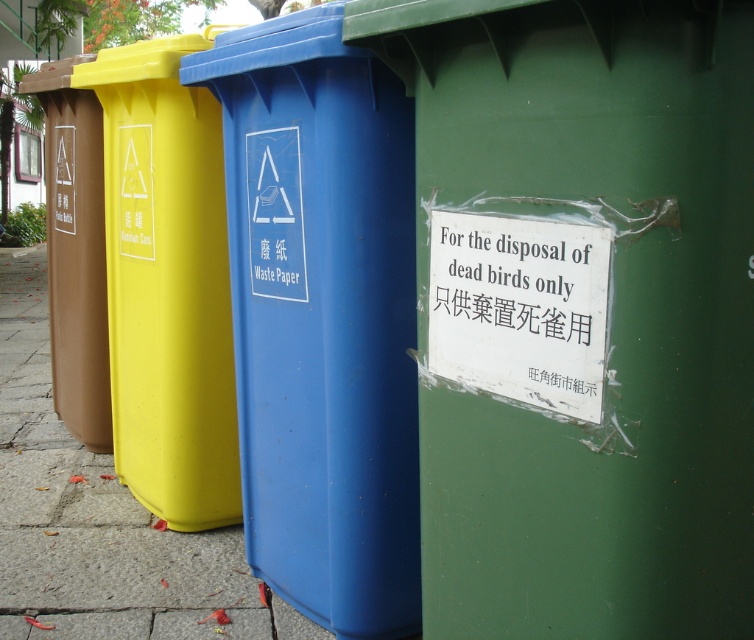
Does point (569, 122) lie behind point (161, 224)?

No, it is in front of (161, 224).

Does point (618, 513) come closer to viewer compared to point (100, 56)?

Yes, point (618, 513) is in front of point (100, 56).

Between point (685, 129) and point (179, 440), which one is positioned in front?

Point (685, 129) is more forward.

You are a GUI agent. You are given a task and a screenshot of the screen. Output one action in this format:
    pyautogui.click(x=<x>, y=<y>)
    Task: Click on the green plastic bin at center
    
    Given the screenshot: What is the action you would take?
    pyautogui.click(x=581, y=310)

This screenshot has height=640, width=754. I want to click on blue plastic waste paper at center, so click(320, 316).

Does blue plastic waste paper at center appear under yellow plastic recycling bin at left?

Yes, blue plastic waste paper at center is below yellow plastic recycling bin at left.

Which is behind, point (409, 371) or point (222, 400)?

Point (222, 400)

You are a GUI agent. You are given a task and a screenshot of the screen. Output one action in this format:
    pyautogui.click(x=<x>, y=<y>)
    Task: Click on the blue plastic waste paper at center
    The image size is (754, 640).
    Given the screenshot: What is the action you would take?
    pyautogui.click(x=320, y=316)

Between yellow plastic recycling bin at left and matte concrete pavement at center, which one is positioned lower?

matte concrete pavement at center is below.

Consider the image. How far apart are yellow plastic recycling bin at left and matte concrete pavement at center?

yellow plastic recycling bin at left is 37.31 inches away from matte concrete pavement at center.

Between point (164, 420) and point (51, 422), which one is positioned behind?

The point (51, 422) is more distant.

Where is `yellow plastic recycling bin at left`? The height and width of the screenshot is (640, 754). yellow plastic recycling bin at left is located at coordinates (167, 284).